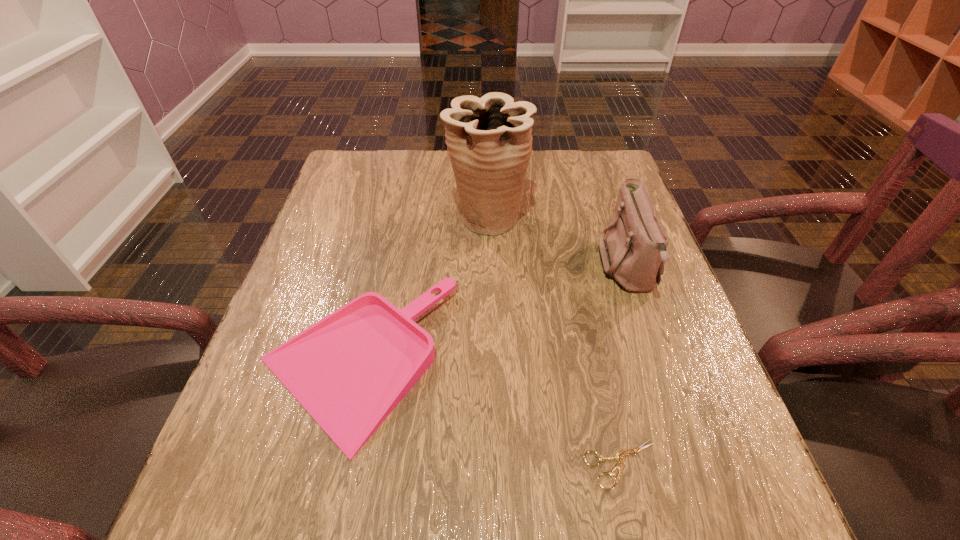
What are the coordinates of `urn` in the screenshot? It's located at [489, 140].

This screenshot has height=540, width=960. What are the coordinates of `shoulder bag` in the screenshot? It's located at (634, 253).

Identify the location of dustpan. (349, 371).

Where is `the shortest object`? This screenshot has width=960, height=540. the shortest object is located at coordinates (620, 456).

You are a GUI agent. You are given a task and a screenshot of the screen. Output one action in this format:
    pyautogui.click(x=<x>, y=<y>)
    Task: Click on the vacant space positioned 0.350m on the front of the urn
    The width and height of the screenshot is (960, 540).
    Given the screenshot: What is the action you would take?
    pyautogui.click(x=490, y=367)

The width and height of the screenshot is (960, 540). What are the coordinates of `vacant space located on the front pocket of the shoulder bag` in the screenshot? It's located at (539, 267).

I want to click on vacant space situated 0.100m on the front pocket of the shoulder bag, so click(556, 267).

Locate an element on the screen. This screenshot has width=960, height=540. free spot located on the front pocket of the shoulder bag is located at coordinates (442, 267).

Where is `free spot located on the right of the shears`? free spot located on the right of the shears is located at coordinates (698, 464).

You are a GUI agent. You are given a task and a screenshot of the screen. Output one action in this format:
    pyautogui.click(x=<x>, y=<y>)
    Task: Click on the object positioned at the far edge
    
    Given the screenshot: What is the action you would take?
    pyautogui.click(x=489, y=140)